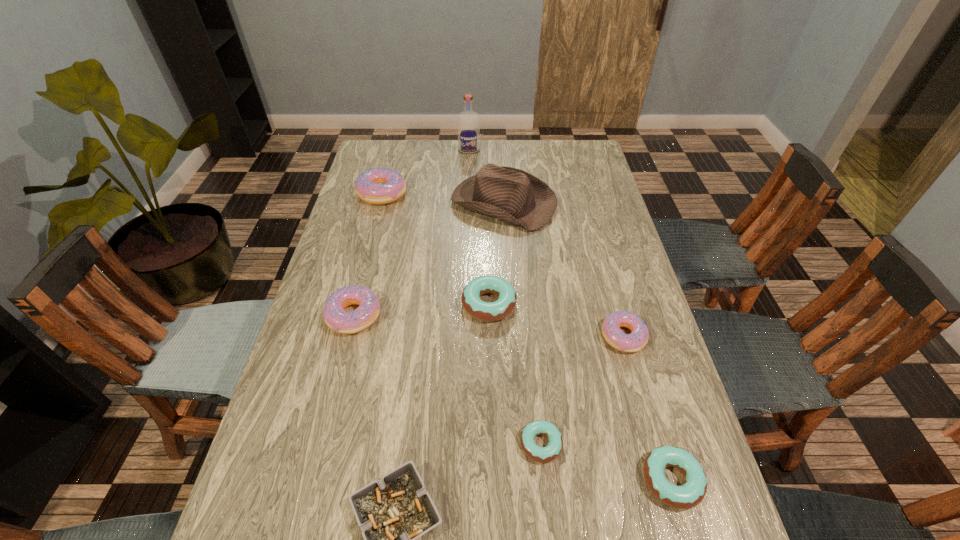
This screenshot has width=960, height=540. I want to click on free location located 0.100m on the right of the smallest blue doughnut, so click(x=609, y=444).

This screenshot has height=540, width=960. Identify the location of object that is at the far edge. (468, 121).

At what (x,y) coordinates should I click in order to perform the action: click on free space at the far edge. Please return your answer as a coordinate pair (x, y). The height and width of the screenshot is (540, 960). Looking at the image, I should click on (527, 147).

In the image, there is a desktop. At what (x,y) coordinates should I click in order to perform the action: click on vacant space at the left edge. Please return your answer as a coordinate pair (x, y). Image resolution: width=960 pixels, height=540 pixels. Looking at the image, I should click on (332, 442).

The width and height of the screenshot is (960, 540). What are the coordinates of `vacant space at the right edge` in the screenshot? It's located at (655, 395).

You are a GUI agent. You are given a task and a screenshot of the screen. Output one action in this format:
    pyautogui.click(x=<x>, y=<y>)
    Task: Click on the free space between the second tallest doughnut and the biggest blue doughnut
    
    Given the screenshot: What is the action you would take?
    pyautogui.click(x=421, y=310)

Where is `free space between the eighth shortest object and the second tallest doughnut`? free space between the eighth shortest object and the second tallest doughnut is located at coordinates (429, 259).

I want to click on free space between the biggest blue doughnut and the second shortest doughnut, so click(x=580, y=392).

Where is `free space between the fedora and the fourth tallest object`? free space between the fedora and the fourth tallest object is located at coordinates coord(429,259).

This screenshot has height=540, width=960. What are the coordinates of `vacant space in between the biggest pink doughnut and the fedora` in the screenshot? It's located at (443, 198).